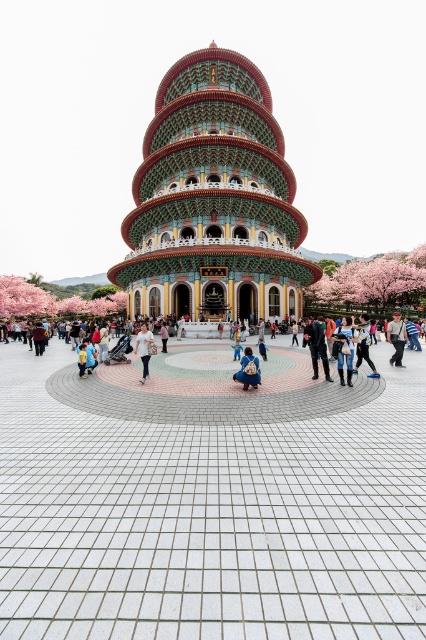
Question: Can you confirm if multicolored painted pagoda at center is wider than yellow fabric bag at center?

Choices:
 (A) yes
 (B) no

Answer: (A)

Question: Is multicolored painted pagoda at center below dark blue fabric jacket at center?

Choices:
 (A) no
 (B) yes

Answer: (A)

Question: Which of the following is the closest to the observer?

Choices:
 (A) yellow fabric bag at center
 (B) light brown leather jacket at center

Answer: (B)

Question: Does multicolored painted pagoda at center have a lesser width compared to yellow fabric bag at center?

Choices:
 (A) yes
 (B) no

Answer: (B)

Question: Which point is closer to the camera taking this photo?

Choices:
 (A) (250, 372)
 (B) (210, 67)
 (C) (163, 352)

Answer: (A)

Question: Which point is farther to the camera?

Choices:
 (A) white tiled plaza at center
 (B) light brown leather jacket at lower right
 (C) black leather pants at center

Answer: (B)